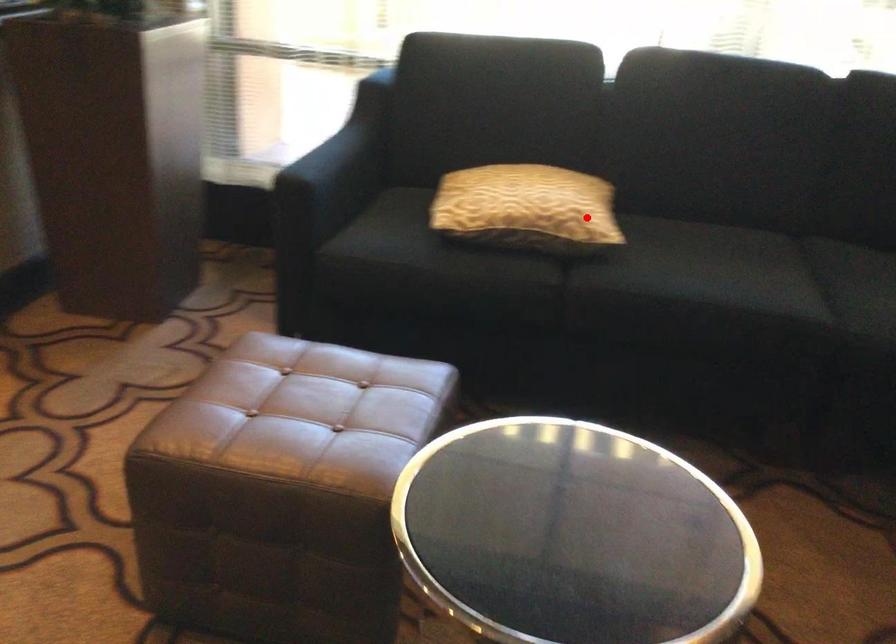
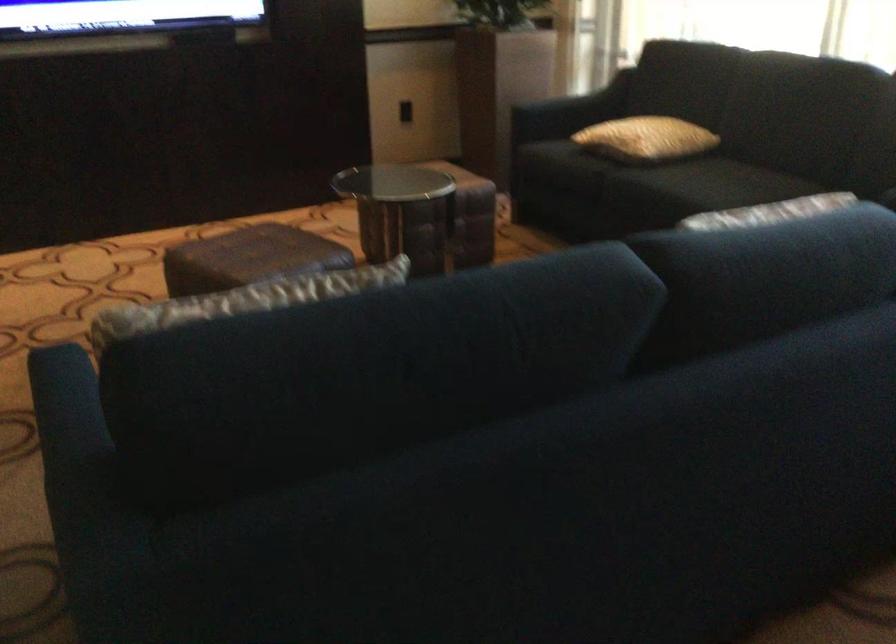
Question: I am providing you with two images of the same scene from different viewpoints. A red point is shown in image1. For the corresponding object point in image2, is it positioned nearer or farther from the camera?

Choices:
 (A) Nearer
 (B) Farther

Answer: (B)